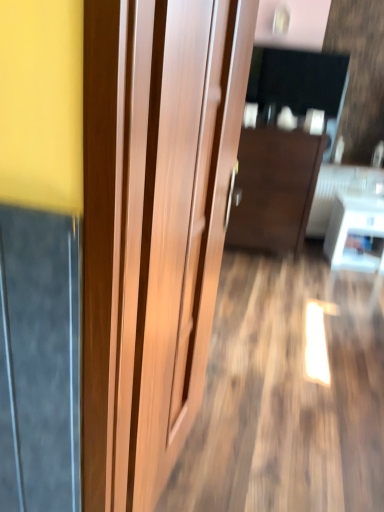
Question: Are white glossy table at lower right and dark wood cabinet at center far apart?

Choices:
 (A) yes
 (B) no

Answer: (B)

Question: Can you confirm if white glossy table at lower right is wider than dark wood cabinet at center?

Choices:
 (A) no
 (B) yes

Answer: (A)

Question: Would you say white glossy table at lower right contains dark wood cabinet at center?

Choices:
 (A) no
 (B) yes

Answer: (A)

Question: Does white glossy table at lower right have a smaller size compared to dark wood cabinet at center?

Choices:
 (A) no
 (B) yes

Answer: (B)

Question: Is white glossy table at lower right thinner than dark wood cabinet at center?

Choices:
 (A) no
 (B) yes

Answer: (B)

Question: Considering the positions of white glossy table at lower right and dark wood cabinet at center in the image, is white glossy table at lower right wider or thinner than dark wood cabinet at center?

Choices:
 (A) thin
 (B) wide

Answer: (A)

Question: From their relative heights in the image, would you say white glossy table at lower right is taller or shorter than dark wood cabinet at center?

Choices:
 (A) short
 (B) tall

Answer: (A)

Question: Considering their positions, is white glossy table at lower right located in front of or behind dark wood cabinet at center?

Choices:
 (A) behind
 (B) front

Answer: (A)

Question: Based on their positions, is white glossy table at lower right located to the left or right of dark wood cabinet at center?

Choices:
 (A) left
 (B) right

Answer: (B)

Question: Would you say wooden door at center is inside or outside white glossy table at lower right?

Choices:
 (A) inside
 (B) outside

Answer: (B)

Question: Based on their positions, is wooden door at center located to the left or right of white glossy table at lower right?

Choices:
 (A) left
 (B) right

Answer: (A)

Question: Looking at their shapes, would you say wooden door at center is wider or thinner than white glossy table at lower right?

Choices:
 (A) wide
 (B) thin

Answer: (B)

Question: Based on their sizes in the image, would you say wooden door at center is bigger or smaller than white glossy table at lower right?

Choices:
 (A) small
 (B) big

Answer: (B)

Question: Is dark wood cabinet at center inside or outside of wooden door at center?

Choices:
 (A) outside
 (B) inside

Answer: (A)

Question: In the image, is dark wood cabinet at center on the left side or the right side of wooden door at center?

Choices:
 (A) left
 (B) right

Answer: (B)